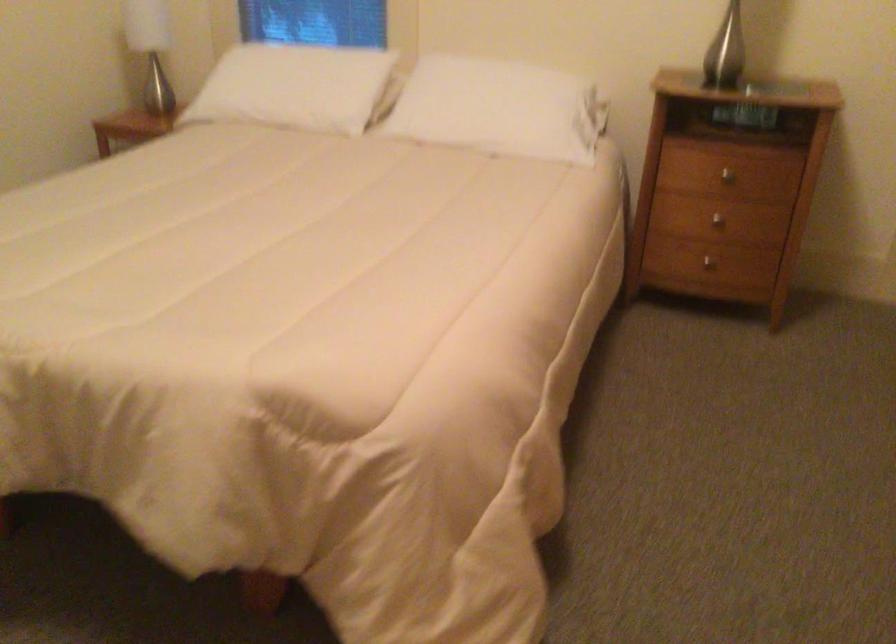
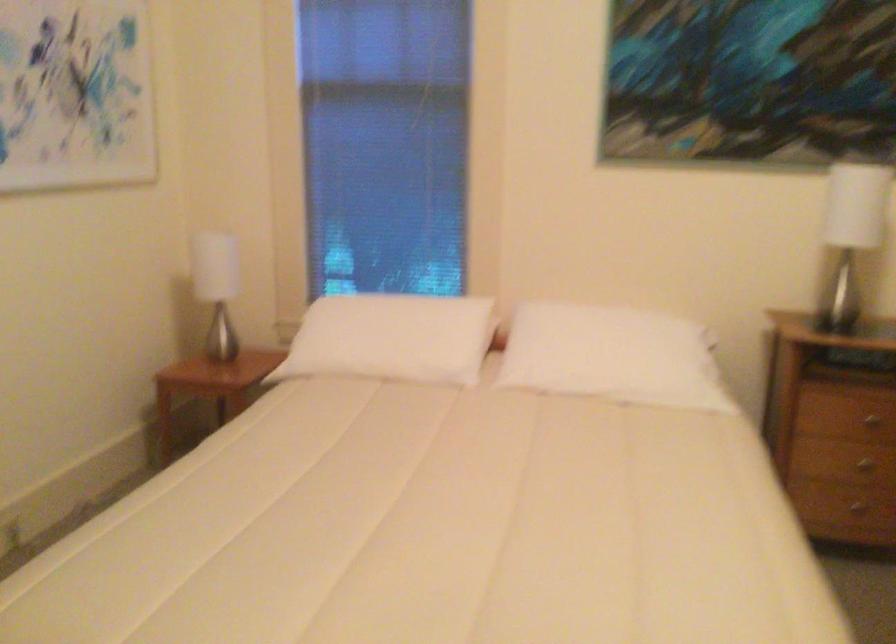
Question: The images are taken continuously from a first-person perspective. In which direction is your viewpoint rotating?

Choices:
 (A) Left
 (B) Right
 (C) Up
 (D) Down

Answer: (C)